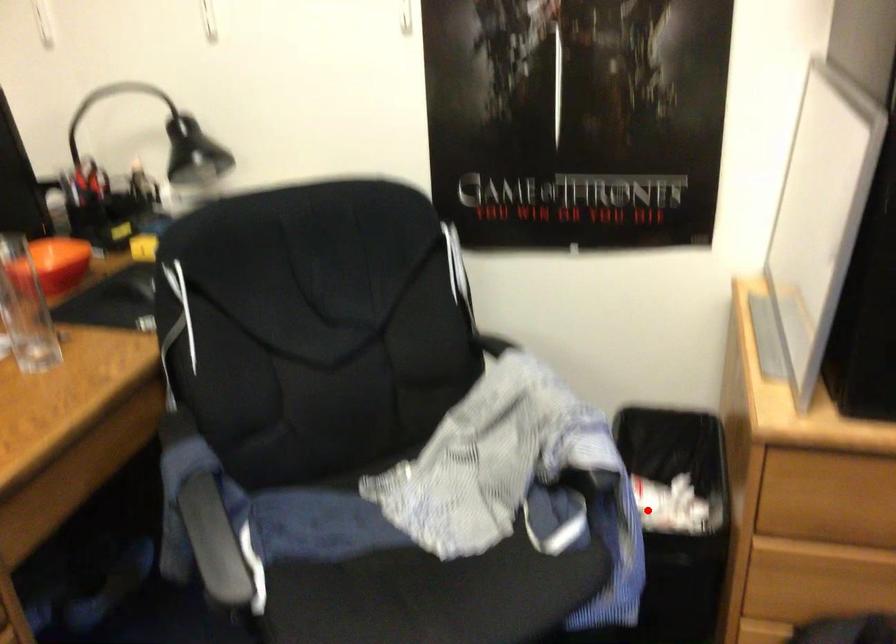
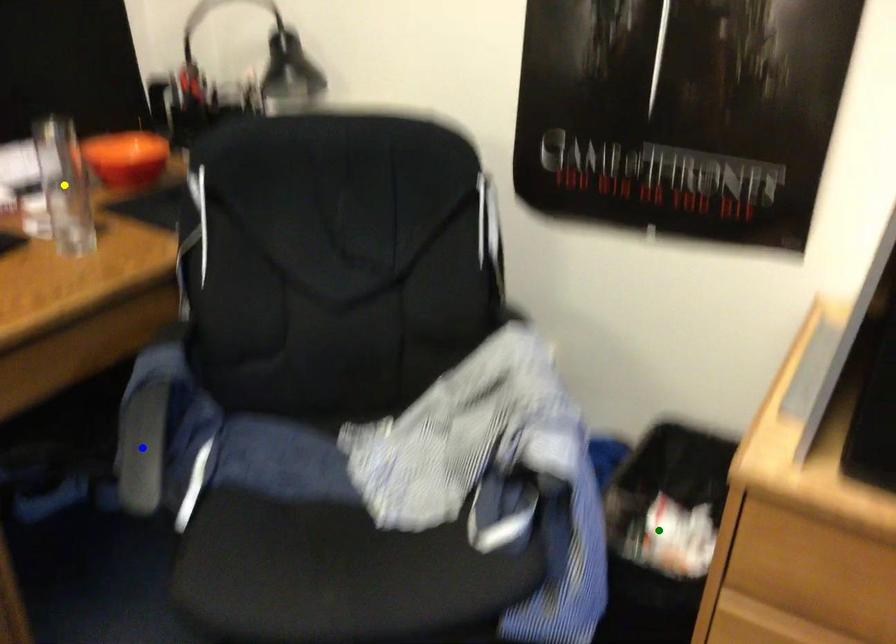
Question: I am providing you with two images of the same scene from different viewpoints. A red point is marked on the first image. You are given multiple points on the second image. Can you choose the point in image 2 that corresponds to the point in image 1?

Choices:
 (A) yellow point
 (B) green point
 (C) blue point

Answer: (B)